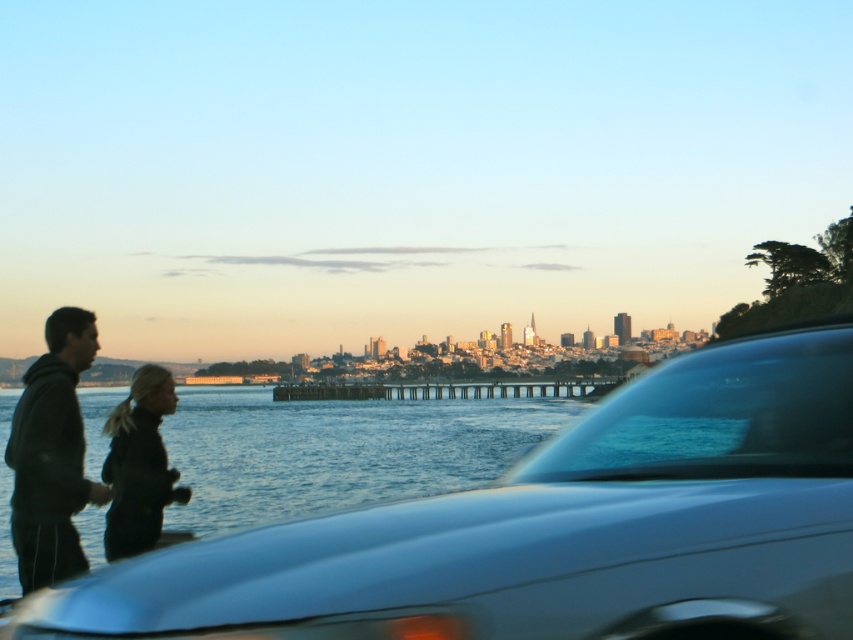
You are a photographer trying to capture both the black matte jacket at left and the black matte jacket at lower left in a single frame. Based on their sizes in the image, which one should you focus on to ensure both are clearly visible?

The black matte jacket at left is much taller than the black matte jacket at lower left, so focusing on the taller one will help ensure both are clearly visible in the frame.

You are standing at the edge of the waterfront scene and see the satin silver car at center and the black matte jacket at left. Which object is positioned more to the right side of the scene?

The satin silver car at center is positioned more to the right side of the scene compared to the black matte jacket at left.

You are a photographer planning to take a photo of the satin silver car at center and the black matte jacket at lower left. Since you want both subjects to appear clearly in the frame, which object should you focus on first to ensure proper focus, considering their sizes?

The satin silver car at center should be focused on first because it is larger in size compared to the black matte jacket at lower left, making it more prominent in the frame.